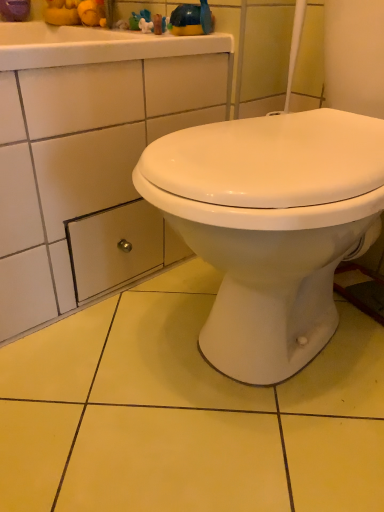
Question: Does blue rubber duck at upper center have a greater width compared to metallic silver drawer at lower left?

Choices:
 (A) no
 (B) yes

Answer: (A)

Question: From the image's perspective, is blue rubber duck at upper center on top of metallic silver drawer at lower left?

Choices:
 (A) yes
 (B) no

Answer: (A)

Question: Does blue rubber duck at upper center have a larger size compared to metallic silver drawer at lower left?

Choices:
 (A) yes
 (B) no

Answer: (B)

Question: From a real-world perspective, is blue rubber duck at upper center over metallic silver drawer at lower left?

Choices:
 (A) yes
 (B) no

Answer: (A)

Question: Is blue rubber duck at upper center taller than metallic silver drawer at lower left?

Choices:
 (A) yes
 (B) no

Answer: (B)

Question: Does blue rubber duck at upper center appear on the right side of metallic silver drawer at lower left?

Choices:
 (A) no
 (B) yes

Answer: (B)

Question: From a real-world perspective, is metallic silver drawer at lower left physically below blue rubber duck at upper center?

Choices:
 (A) no
 (B) yes

Answer: (B)

Question: From the image's perspective, is metallic silver drawer at lower left on top of blue rubber duck at upper center?

Choices:
 (A) yes
 (B) no

Answer: (B)

Question: Can you confirm if metallic silver drawer at lower left is thinner than blue rubber duck at upper center?

Choices:
 (A) no
 (B) yes

Answer: (A)

Question: Is metallic silver drawer at lower left far from blue rubber duck at upper center?

Choices:
 (A) yes
 (B) no

Answer: (B)

Question: Is metallic silver drawer at lower left closer to the viewer compared to blue rubber duck at upper center?

Choices:
 (A) no
 (B) yes

Answer: (B)

Question: From a real-world perspective, does metallic silver drawer at lower left stand above blue rubber duck at upper center?

Choices:
 (A) yes
 (B) no

Answer: (B)

Question: From the image's perspective, is metallic silver drawer at lower left above or below blue rubber duck at upper center?

Choices:
 (A) below
 (B) above

Answer: (A)